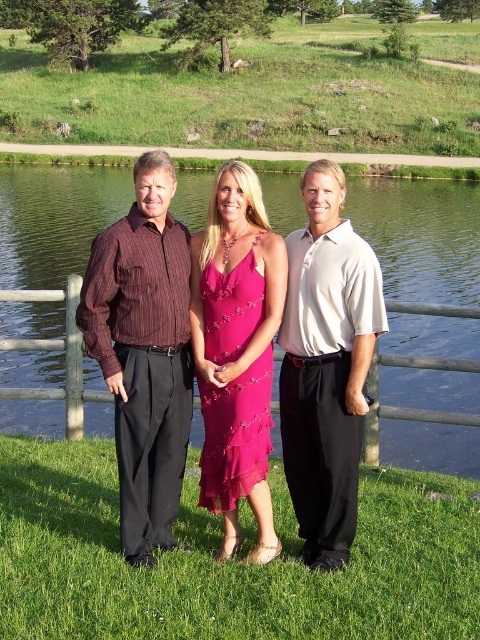
You are a photographer planning to take a group photo of the three people in the scene. You want to arrange them so that the white cotton polo shirt at center and the pink satin dress at center are positioned side by side. Based on their current positions, which one should move to the left to make this happen?

The white cotton polo shirt at center is currently to the right of the pink satin dress at center. To position them side by side, the white cotton polo shirt at center should move to the left so that it aligns next to the pink satin dress at center.

You are planning to place a small picnic basket between the green grass at lower center and the pink satin dress at center. Based on their widths, which object should you place the basket next to to ensure it fits comfortably?

The green grass at lower center might be wider than the pink satin dress at center, so placing the picnic basket next to the green grass at lower center would provide more space for it to fit comfortably.

You are a photographer trying to capture the scene. You notice the white cotton polo shirt at center and the pink satin dress at center. Which clothing item is positioned higher in the image?

The white cotton polo shirt at center is above the pink satin dress at center, so it is positioned higher in the image.